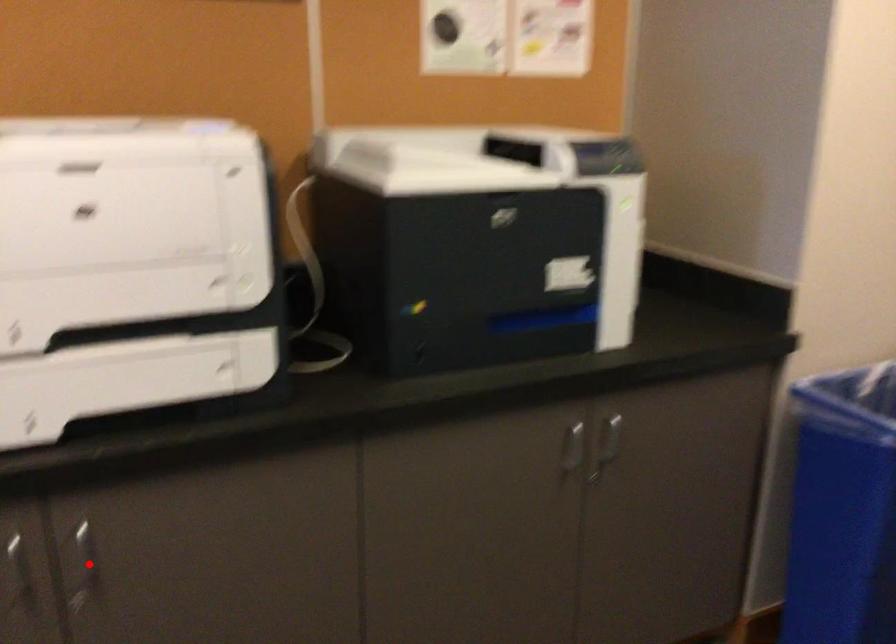
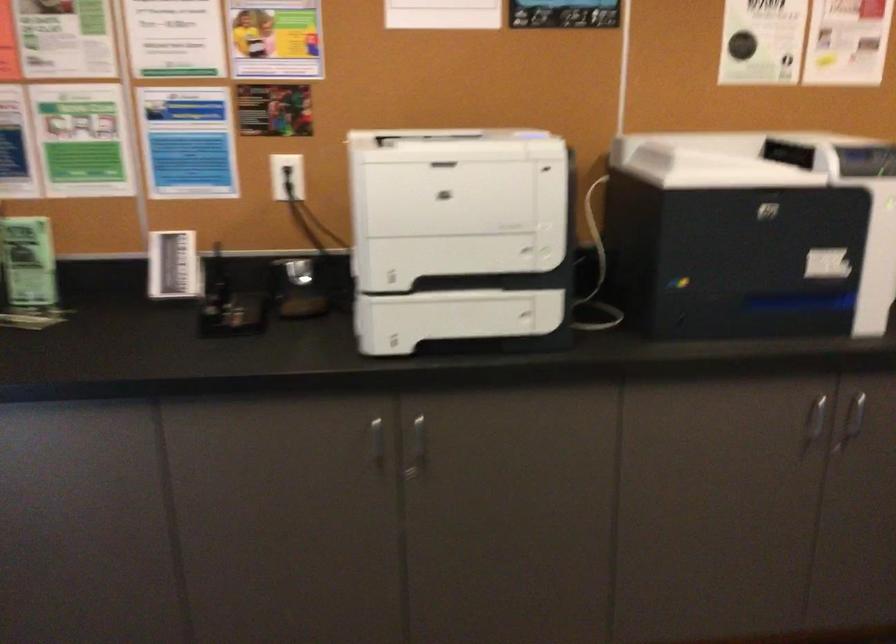
Question: A red point is marked in image1. In image2, is the corresponding 3D point closer to the camera or farther? Reply with the corresponding letter.

Choices:
 (A) The corresponding 3D point is closer.
 (B) The corresponding 3D point is farther.

Answer: (B)